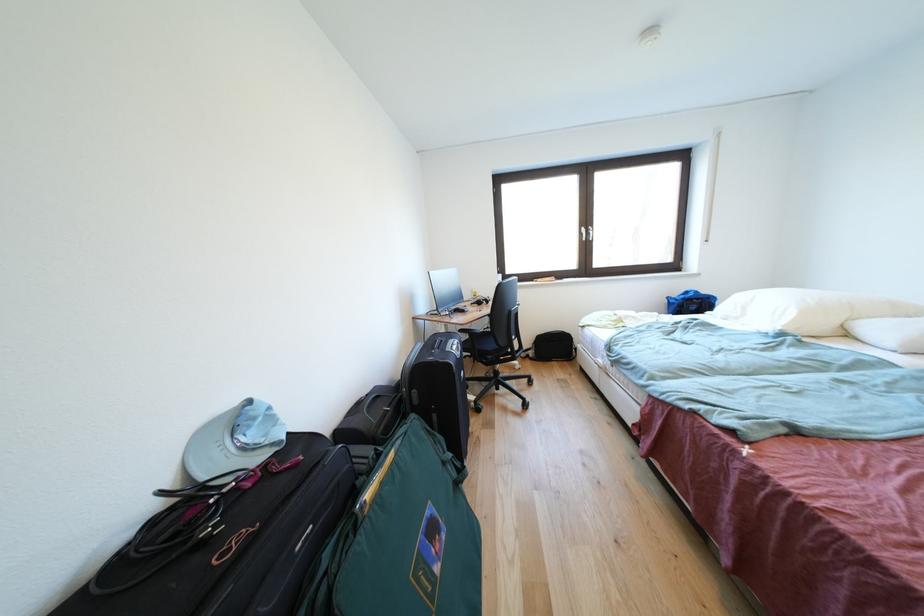
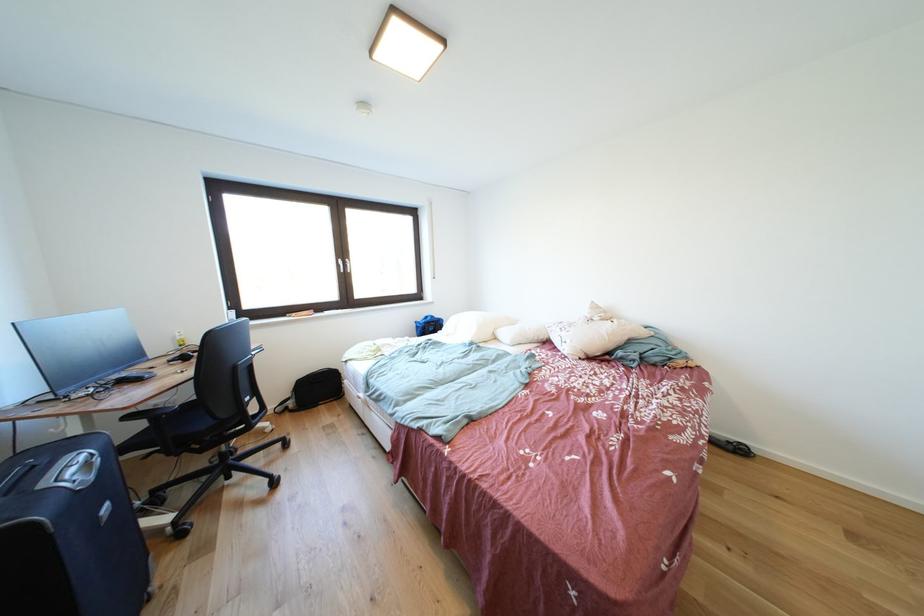
Question: The first image is from the beginning of the video and the second image is from the end. How did the camera likely rotate when shooting the video?

Choices:
 (A) Left
 (B) Right
 (C) Up
 (D) Down

Answer: (B)